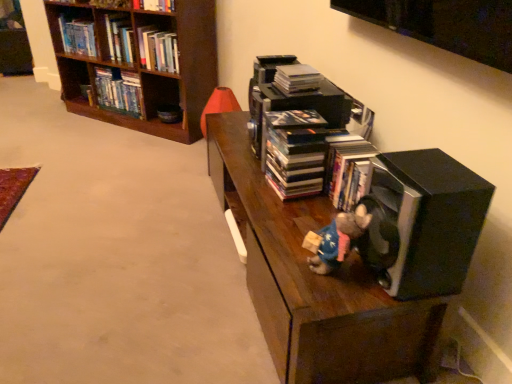
Locate an element on the screen. blank area to the left of plush toy at center is located at coordinates (290, 263).